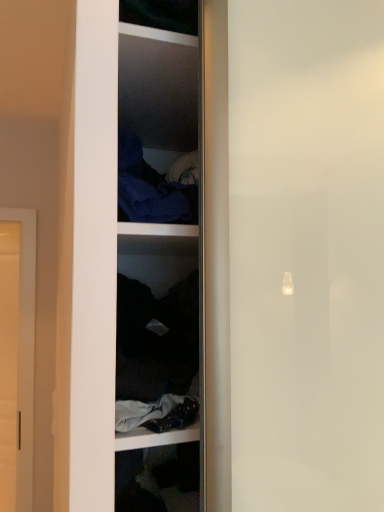
Question: Is matte white door at left to the right of dark fabric at center from the viewer's perspective?

Choices:
 (A) yes
 (B) no

Answer: (B)

Question: From the image's perspective, is matte white door at left beneath dark fabric at center?

Choices:
 (A) yes
 (B) no

Answer: (A)

Question: From a real-world perspective, is matte white door at left physically below dark fabric at center?

Choices:
 (A) yes
 (B) no

Answer: (A)

Question: Considering the relative positions of matte white door at left and dark fabric at center in the image provided, is matte white door at left behind dark fabric at center?

Choices:
 (A) yes
 (B) no

Answer: (A)

Question: From the image's perspective, is matte white door at left above dark fabric at center?

Choices:
 (A) yes
 (B) no

Answer: (B)

Question: From their relative heights in the image, would you say dark fabric at center is taller or shorter than matte white door at left?

Choices:
 (A) tall
 (B) short

Answer: (B)

Question: In the image, is dark fabric at center positioned in front of or behind matte white door at left?

Choices:
 (A) front
 (B) behind

Answer: (A)

Question: Is point (170, 313) closer or farther from the camera than point (11, 237)?

Choices:
 (A) farther
 (B) closer

Answer: (B)

Question: Considering the positions of dark fabric at center and matte white door at left in the image, is dark fabric at center bigger or smaller than matte white door at left?

Choices:
 (A) small
 (B) big

Answer: (A)

Question: Considering the positions of dark blue fabric at upper center and dark fabric at center in the image, is dark blue fabric at upper center bigger or smaller than dark fabric at center?

Choices:
 (A) big
 (B) small

Answer: (B)

Question: From the image's perspective, relative to dark fabric at center, is dark blue fabric at upper center above or below?

Choices:
 (A) above
 (B) below

Answer: (A)

Question: Is dark blue fabric at upper center situated inside dark fabric at center or outside?

Choices:
 (A) outside
 (B) inside

Answer: (A)

Question: In the image, is dark blue fabric at upper center positioned in front of or behind dark fabric at center?

Choices:
 (A) front
 (B) behind

Answer: (B)

Question: Is matte white door at left in front of or behind dark fabric at center in the image?

Choices:
 (A) behind
 (B) front

Answer: (A)

Question: Is matte white door at left wider or thinner than dark fabric at center?

Choices:
 (A) wide
 (B) thin

Answer: (B)